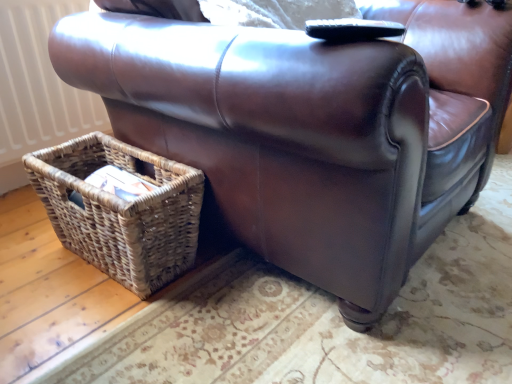
What do you see at coordinates (120, 210) in the screenshot? I see `woven natural picnic basket at lower left` at bounding box center [120, 210].

Locate an element on the screen. The height and width of the screenshot is (384, 512). woven natural picnic basket at lower left is located at coordinates (120, 210).

Find the location of a particular element. The image size is (512, 384). woven natural picnic basket at lower left is located at coordinates (120, 210).